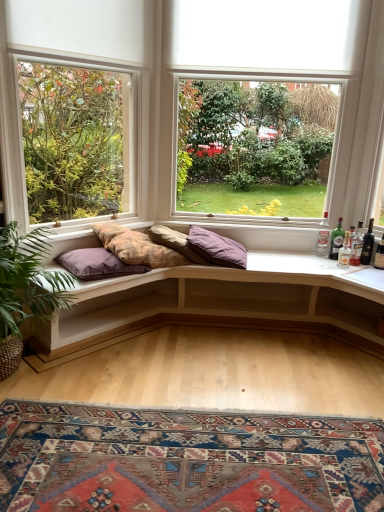
Question: From the image's perspective, is matte white window at center, placed as the 1th window when sorted from left to right, positioned above or below translucent glass bottle at right, which is counted as the 5th bottle, starting from the left?

Choices:
 (A) below
 (B) above

Answer: (B)

Question: From a real-world perspective, is matte white window at center, placed as the 1th window when sorted from left to right, positioned above or below translucent glass bottle at right, which is the 1th bottle from right to left?

Choices:
 (A) below
 (B) above

Answer: (B)

Question: Which is nearer to the translucent glass bottle at right, which is counted as the 5th bottle, starting from the left?

Choices:
 (A) clear glass bottle at right, the first bottle from the left
 (B) matte white window at center, which appears as the 1th window when viewed from the right
 (C) wooden cushioned bench at center
 (D) green leafy plant at left
 (E) textured fabric pillow at center, which ranks as the 2th pillow in right-to-left order

Answer: (A)

Question: Which of these objects is positioned closest to the purple soft cushion at center, which is the 1th pillow in right-to-left order?

Choices:
 (A) textured cotton cushions at center
 (B) carpeted rug at lower center
 (C) purple soft cushion at left, which ranks as the first pillow in left-to-right order
 (D) matte white window at center, the second window positioned from the right
 (E) clear glass bottle at right, positioned as the second bottle in right-to-left order

Answer: (A)